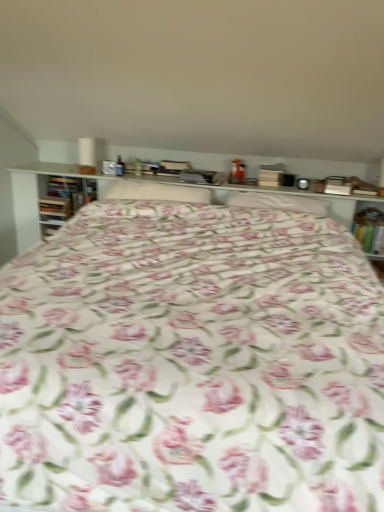
Question: Do you think hardcover book at left, which appears as the 2th book when viewed from the right, is within white fabric pillow at center, the first pillow viewed from the left, or outside of it?

Choices:
 (A) inside
 (B) outside

Answer: (B)

Question: From the image's perspective, is hardcover book at left, acting as the second book starting from the left, located above or below white fabric pillow at center, which is the second pillow in right-to-left order?

Choices:
 (A) above
 (B) below

Answer: (A)

Question: Estimate the real-world distances between objects in this image. Which object is farther from the floral fabric bed at center?

Choices:
 (A) floral fabric pillow at center, which is counted as the second pillow, starting from the left
 (B) wooden book at left, which appears as the third book when viewed from the right
 (C) hardcover book at right, positioned as the third book in left-to-right order
 (D) hardcover book at left, acting as the second book starting from the left
 (E) white fabric pillow at center, which is the second pillow in right-to-left order

Answer: (B)

Question: Estimate the real-world distances between objects in this image. Which object is farther from the white fabric pillow at center, the first pillow viewed from the left?

Choices:
 (A) hardcover book at right, positioned as the third book in left-to-right order
 (B) hardcover book at left, acting as the second book starting from the left
 (C) floral fabric bed at center
 (D) wooden book at left, which is the first book in left-to-right order
 (E) floral fabric pillow at center, the first pillow when ordered from right to left

Answer: (A)